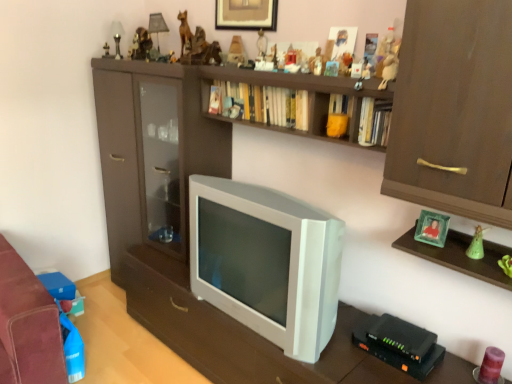
Question: Does matte plastic pyramid at upper center, positioned as the 8th toy in bottom-to-top order, lie behind matte plastic toy at upper center, which is the 8th toy from top to bottom?

Choices:
 (A) yes
 (B) no

Answer: (A)

Question: Is matte plastic pyramid at upper center, which ranks as the eighth toy in front-to-back order, at the left side of matte plastic toy at upper center, which is the 8th toy from left to right?

Choices:
 (A) yes
 (B) no

Answer: (A)

Question: Can you confirm if matte plastic pyramid at upper center, which ranks as the eighth toy in front-to-back order, is smaller than matte plastic toy at upper center, marked as the 4th toy in a front-to-back arrangement?

Choices:
 (A) yes
 (B) no

Answer: (B)

Question: Is matte plastic pyramid at upper center, which is counted as the seventh toy, starting from the right, looking in the opposite direction of matte plastic toy at upper center, which is the 8th toy from top to bottom?

Choices:
 (A) no
 (B) yes

Answer: (A)

Question: Considering the relative sizes of matte plastic pyramid at upper center, the 5th toy when ordered from left to right, and matte plastic toy at upper center, which is the fourth toy from bottom to top, in the image provided, is matte plastic pyramid at upper center, the 5th toy when ordered from left to right, thinner than matte plastic toy at upper center, which is the fourth toy from bottom to top,?

Choices:
 (A) no
 (B) yes

Answer: (A)

Question: Is point (234, 57) positioned closer to the camera than point (183, 41)?

Choices:
 (A) closer
 (B) farther

Answer: (A)

Question: Considering the positions of matte plastic pyramid at upper center, the 5th toy when ordered from left to right, and matte brown statue at upper center, acting as the 10th toy starting from the front, in the image, is matte plastic pyramid at upper center, the 5th toy when ordered from left to right, wider or thinner than matte brown statue at upper center, acting as the 10th toy starting from the front,?

Choices:
 (A) thin
 (B) wide

Answer: (A)

Question: Is matte plastic pyramid at upper center, which ranks as the eighth toy in front-to-back order, bigger or smaller than matte brown statue at upper center, acting as the 10th toy starting from the front?

Choices:
 (A) small
 (B) big

Answer: (A)

Question: Relative to matte brown statue at upper center, acting as the second toy starting from the back, is matte plastic pyramid at upper center, the 4th toy viewed from the back, in front or behind?

Choices:
 (A) front
 (B) behind

Answer: (A)

Question: From their relative heights in the image, would you say matte wooden figurine at upper center, which is the seventh toy in bottom-to-top order, is taller or shorter than matte plastic pyramid at upper center, the fourth toy in the top-to-bottom sequence?

Choices:
 (A) short
 (B) tall

Answer: (A)

Question: Considering the positions of matte wooden figurine at upper center, which is counted as the 2th toy, starting from the left, and matte plastic pyramid at upper center, the fourth toy in the top-to-bottom sequence, in the image, is matte wooden figurine at upper center, which is counted as the 2th toy, starting from the left, wider or thinner than matte plastic pyramid at upper center, the fourth toy in the top-to-bottom sequence,?

Choices:
 (A) thin
 (B) wide

Answer: (A)

Question: Would you say matte wooden figurine at upper center, which ranks as the fifth toy in top-to-bottom order, is inside or outside matte plastic pyramid at upper center, the 4th toy viewed from the back?

Choices:
 (A) outside
 (B) inside

Answer: (A)

Question: From the image's perspective, is matte wooden figurine at upper center, the 3th toy from the back, positioned above or below matte plastic pyramid at upper center, which ranks as the eighth toy in front-to-back order?

Choices:
 (A) below
 (B) above

Answer: (A)

Question: From a real-world perspective, is matte brown figurine at upper center, the fifth toy positioned from the bottom, above or below green glass photo frame at upper right?

Choices:
 (A) below
 (B) above

Answer: (B)

Question: From the image's perspective, is matte brown figurine at upper center, which ranks as the 7th toy in top-to-bottom order, located above or below green glass photo frame at upper right?

Choices:
 (A) above
 (B) below

Answer: (A)